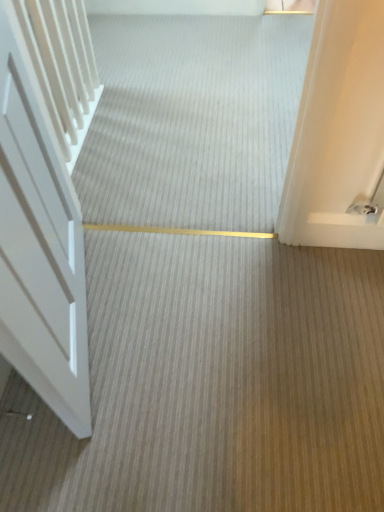
Question: Relative to white matte door at left, is smooth beige carpet at center in front or behind?

Choices:
 (A) behind
 (B) front

Answer: (A)

Question: From the image's perspective, is smooth beige carpet at center located above or below white matte door at left?

Choices:
 (A) above
 (B) below

Answer: (A)

Question: Considering the positions of smooth beige carpet at center and white matte door at left in the image, is smooth beige carpet at center taller or shorter than white matte door at left?

Choices:
 (A) short
 (B) tall

Answer: (A)

Question: From a real-world perspective, is white matte door at left physically located above or below smooth beige carpet at center?

Choices:
 (A) above
 (B) below

Answer: (A)

Question: Looking at their shapes, would you say white matte door at left is wider or thinner than smooth beige carpet at center?

Choices:
 (A) thin
 (B) wide

Answer: (A)

Question: From the image's perspective, is white matte door at left above or below smooth beige carpet at center?

Choices:
 (A) above
 (B) below

Answer: (B)

Question: Considering the positions of white matte door at left and smooth beige carpet at center in the image, is white matte door at left taller or shorter than smooth beige carpet at center?

Choices:
 (A) short
 (B) tall

Answer: (B)